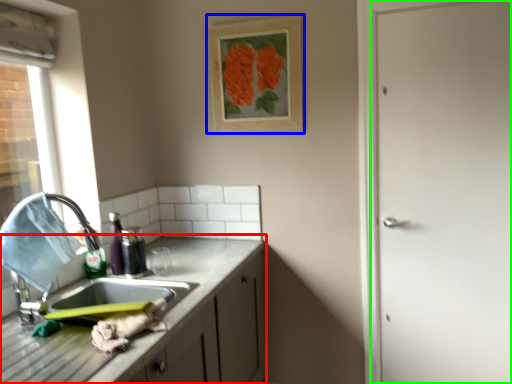
Question: Estimate the real-world distances between objects in this image. Which object is farther from cabinetry (highlighted by a red box), picture frame (highlighted by a blue box) or door (highlighted by a green box)?

Choices:
 (A) picture frame
 (B) door

Answer: (B)